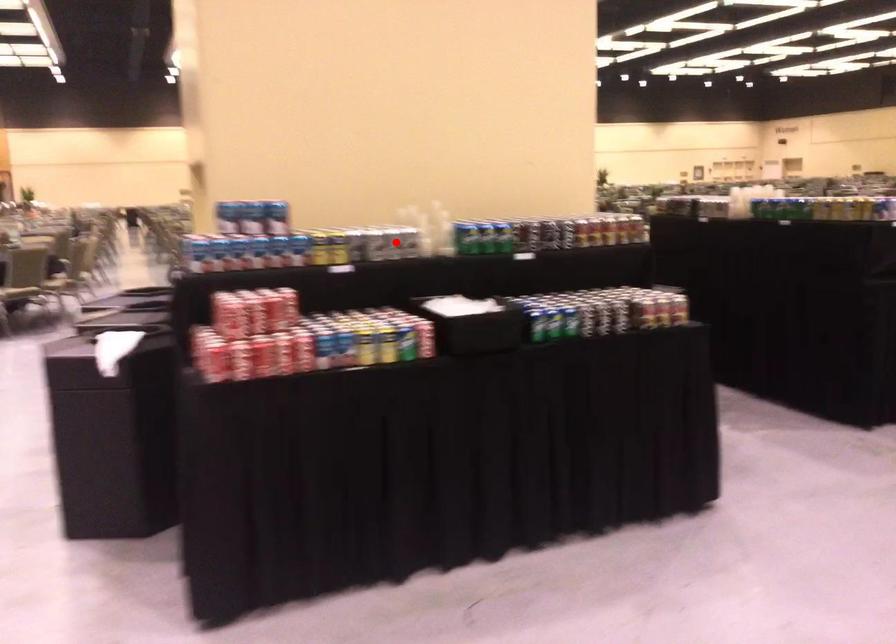
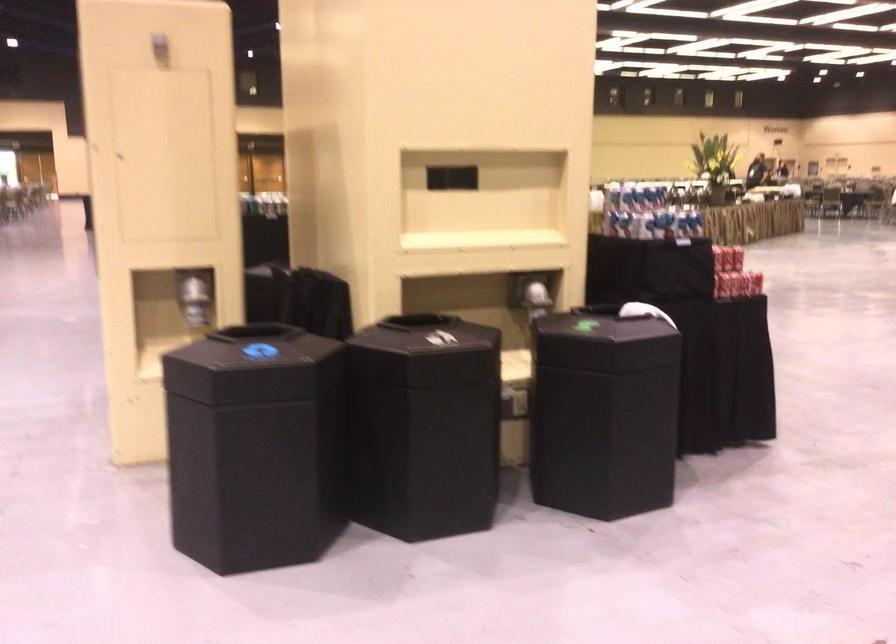
Question: I am providing you with two images of the same scene from different viewpoints. A red point is marked on the first image. Is the red point's position out of view in image 2?

Choices:
 (A) Yes
 (B) No

Answer: (A)